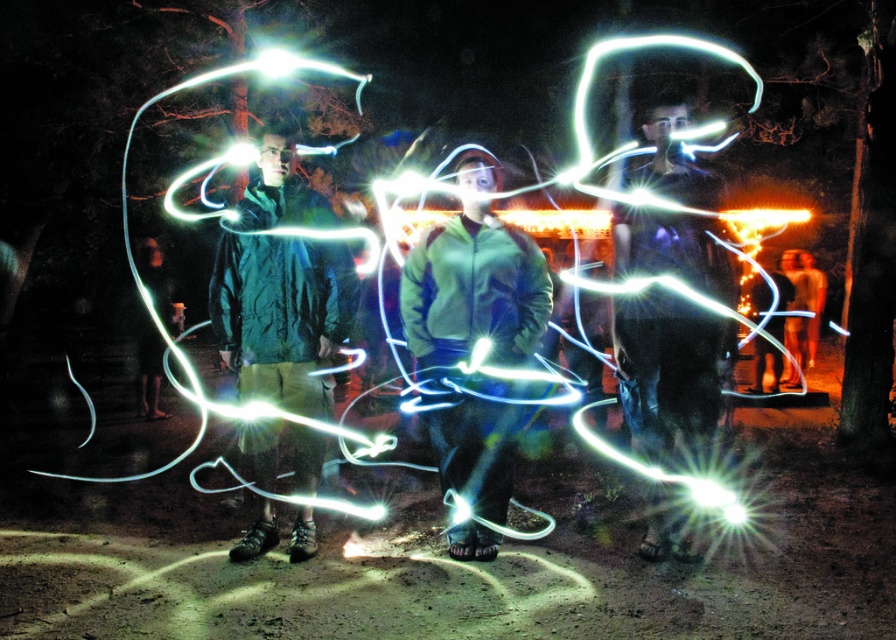
Does green fleece jacket at center come behind matte black jacket at center?

Yes, it is behind matte black jacket at center.

Does green fleece jacket at center appear over matte black jacket at center?

Actually, green fleece jacket at center is below matte black jacket at center.

This screenshot has height=640, width=896. What are the coordinates of `green fleece jacket at center` in the screenshot? It's located at (472, 291).

Is green matte jacket at center to the left of matte black jacket at center from the viewer's perspective?

Indeed, green matte jacket at center is positioned on the left side of matte black jacket at center.

Between point (278, 204) and point (644, 316), which one is positioned behind?

Positioned behind is point (278, 204).

Locate an element on the screen. The height and width of the screenshot is (640, 896). green matte jacket at center is located at coordinates (281, 285).

Is green matte jacket at center taller than green fleece jacket at center?

Correct, green matte jacket at center is much taller as green fleece jacket at center.

Between green matte jacket at center and green fleece jacket at center, which one has less height?

green fleece jacket at center

Which is in front, point (306, 428) or point (531, 248)?

Point (531, 248)

I want to click on green matte jacket at center, so click(x=281, y=285).